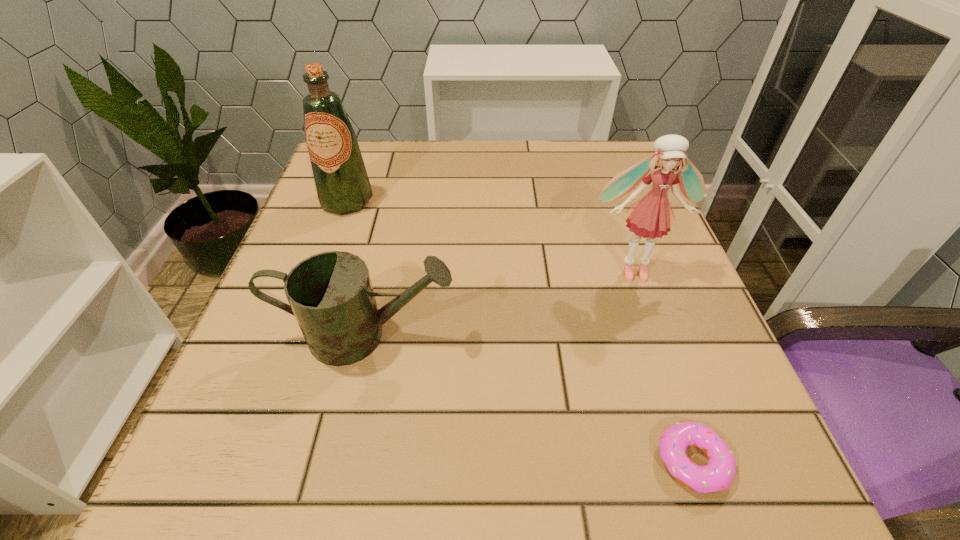
This screenshot has height=540, width=960. I want to click on object that is at the far edge, so click(341, 181).

You are a GUI agent. You are given a task and a screenshot of the screen. Output one action in this format:
    pyautogui.click(x=<x>, y=<y>)
    Task: Click on the object that is at the near edge
    This screenshot has height=540, width=960.
    Given the screenshot: What is the action you would take?
    pyautogui.click(x=718, y=475)

Locate an element on the screen. olive oil positioned at the left edge is located at coordinates (341, 181).

You are a GUI agent. You are given a task and a screenshot of the screen. Output one action in this format:
    pyautogui.click(x=<x>, y=<y>)
    Task: Click on the watering can that is at the left edge
    The image size is (960, 540).
    Given the screenshot: What is the action you would take?
    pyautogui.click(x=330, y=294)

The width and height of the screenshot is (960, 540). Identify the location of doll present at the right edge. (651, 217).

Where is `doughnut located in the right edge section of the desktop`? Image resolution: width=960 pixels, height=540 pixels. doughnut located in the right edge section of the desktop is located at coordinates (718, 475).

Identify the location of object that is at the far left corner. The height and width of the screenshot is (540, 960). (341, 181).

Where is `object at the near right corner`? The image size is (960, 540). object at the near right corner is located at coordinates (718, 475).

At what (x,y) coordinates should I click in order to perform the action: click on vacant space at the far edge of the desktop. Please return your answer as a coordinate pair (x, y). Image resolution: width=960 pixels, height=540 pixels. Looking at the image, I should click on (491, 184).

In order to click on blank space at the left edge of the desktop in this screenshot , I will do `click(367, 213)`.